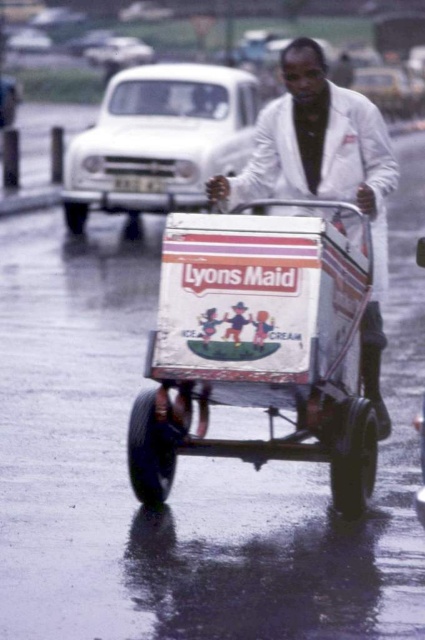
Can you confirm if metallic ice cream wagon at center is bigger than white matte jacket at center?

Correct, metallic ice cream wagon at center is larger in size than white matte jacket at center.

Which is more to the left, metallic ice cream wagon at center or white matte jacket at center?

From the viewer's perspective, metallic ice cream wagon at center appears more on the left side.

Between point (197, 291) and point (286, 84), which one is positioned in front?

Point (197, 291) is in front.

Where is `metallic ice cream wagon at center`? This screenshot has width=425, height=640. metallic ice cream wagon at center is located at coordinates (257, 348).